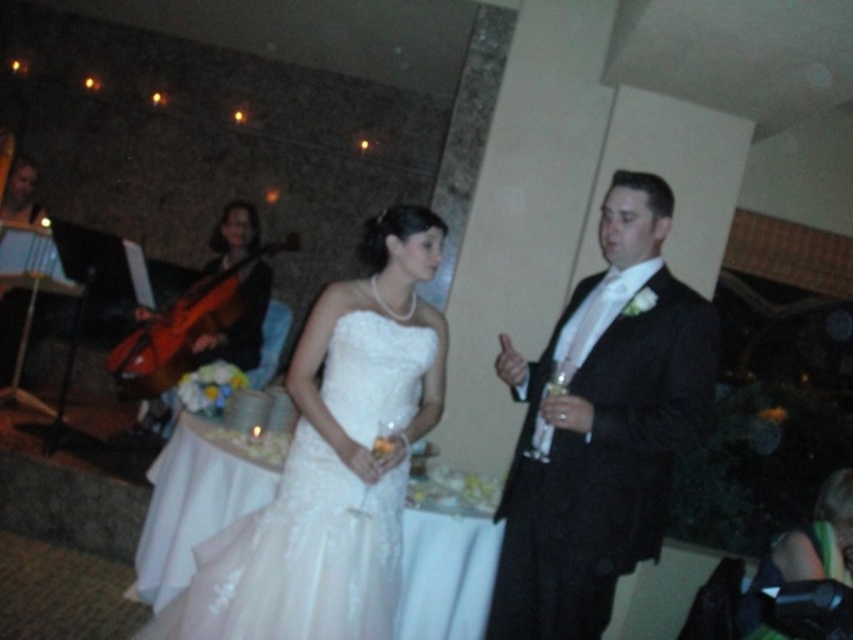
Question: Observing the image, what is the correct spatial positioning of white lace dress at center in reference to matte brown cello at left?

Choices:
 (A) left
 (B) right

Answer: (B)

Question: Is white lace dress at center closer to the viewer compared to matte brown cello at left?

Choices:
 (A) yes
 (B) no

Answer: (A)

Question: Among these points, which one is nearest to the camera?

Choices:
 (A) (283, 634)
 (B) (257, 220)
 (C) (561, 544)

Answer: (A)

Question: Among these points, which one is farthest from the camera?

Choices:
 (A) (524, 552)
 (B) (315, 618)
 (C) (250, 316)
 (D) (712, 371)

Answer: (C)

Question: Which object is positioned farthest from the white lace dress at center?

Choices:
 (A) black satin tuxedo at right
 (B) matte brown cello at left
 (C) white satin dress at center

Answer: (B)

Question: Can you confirm if black satin tuxedo at right is thinner than white satin dress at center?

Choices:
 (A) no
 (B) yes

Answer: (B)